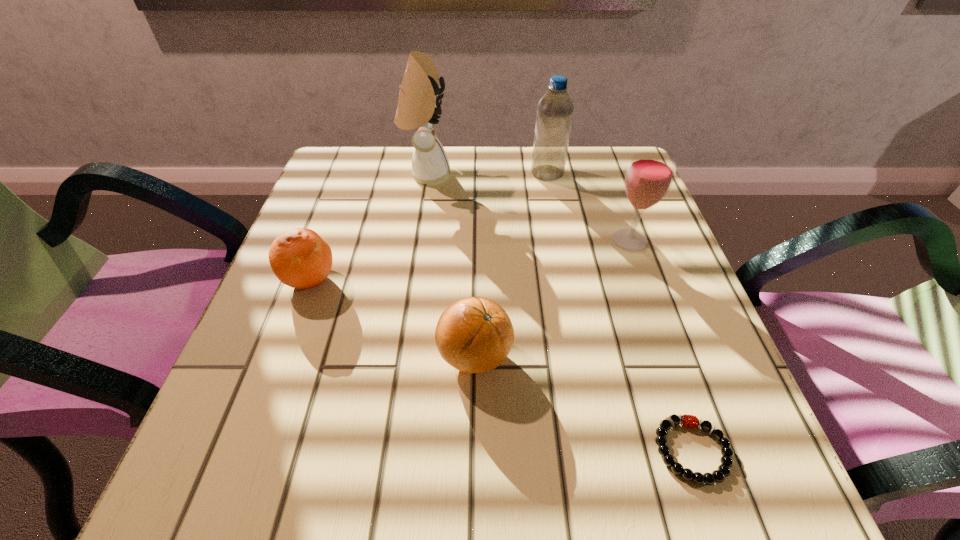
At what (x,y) coordinates should I click in order to perform the action: click on the tallest object. Please return your answer as a coordinate pair (x, y). Looking at the image, I should click on (418, 107).

Where is `the fifth object from right to left`? the fifth object from right to left is located at coordinates (418, 107).

Identify the location of the fourth object from left to right. (555, 109).

Find the location of `water bottle`. water bottle is located at coordinates (555, 109).

Find the location of a particular element. This screenshot has height=540, width=960. wineglass is located at coordinates (649, 176).

Identify the location of the third tallest object. The width and height of the screenshot is (960, 540). (649, 176).

Where is `the fifth farthest object`? This screenshot has width=960, height=540. the fifth farthest object is located at coordinates (474, 334).

You are a GUI agent. You are given a task and a screenshot of the screen. Output one action in this format:
    pyautogui.click(x=<x>, y=<y>)
    Task: Click on the nearer orange
    The width and height of the screenshot is (960, 540).
    Given the screenshot: What is the action you would take?
    pyautogui.click(x=474, y=334)

Locate an element on the screen. This screenshot has width=960, height=540. the leftmost object is located at coordinates (300, 258).

Identify the location of the fourth farthest object. Image resolution: width=960 pixels, height=540 pixels. (300, 258).